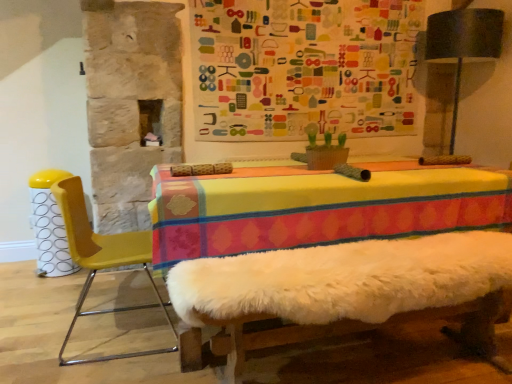
Locate an element on the screen. The image size is (512, 384). free spot to the left of yellow plastic chair at left is located at coordinates (38, 332).